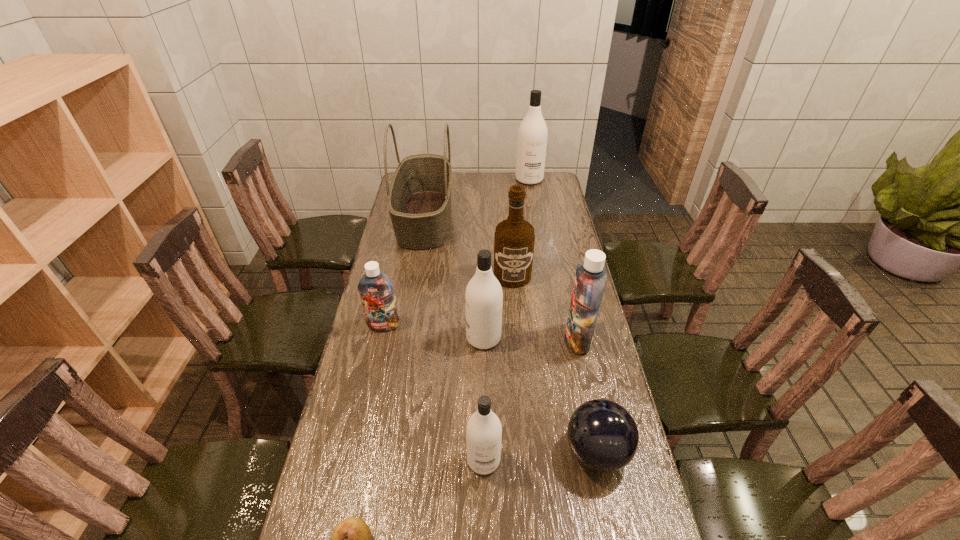
The image size is (960, 540). In order to click on empty space that is in between the black bowling ball and the second biggest white shampoo in this screenshot , I will do `click(540, 395)`.

Identify which object is located as the seventh nearest to the second farthest object. Please provide its 2D coordinates. Your answer should be formatted as a tuple, i.e. [(x, y)], where the tuple contains the x and y coordinates of a point satisfying the conditions above.

[(602, 434)]

Find the location of a particular element. The image size is (960, 540). object that is the sixth closest to the second shortest object is located at coordinates (376, 290).

You are a GUI agent. You are given a task and a screenshot of the screen. Output one action in this format:
    pyautogui.click(x=<x>, y=<y>)
    Task: Click on the third closest shampoo to the smaller blue shampoo
    
    Given the screenshot: What is the action you would take?
    pos(590,279)

Identify which shampoo is the nearest to the second biggest white shampoo. Please provide its 2D coordinates. Your answer should be formatted as a tuple, i.e. [(x, y)], where the tuple contains the x and y coordinates of a point satisfying the conditions above.

[(590, 279)]

Find the location of a particular element. white shampoo that can be found as the second closest to the nearest white shampoo is located at coordinates (532, 135).

Locate an element on the screen. Image resolution: width=960 pixels, height=540 pixels. white shampoo that can be found as the closest to the alcohol is located at coordinates (483, 297).

What are the coordinates of `free space that satisfies the following two spatial constraints: 1. on the front-facing side of the biggest white shampoo; 2. on the front-facing side of the second smallest white shampoo` in the screenshot? It's located at (557, 338).

Find the location of a particular element. vacant space that satisfies the following two spatial constraints: 1. on the front-facing side of the biggest white shampoo; 2. on the front-facing side of the second nearest white shampoo is located at coordinates (557, 338).